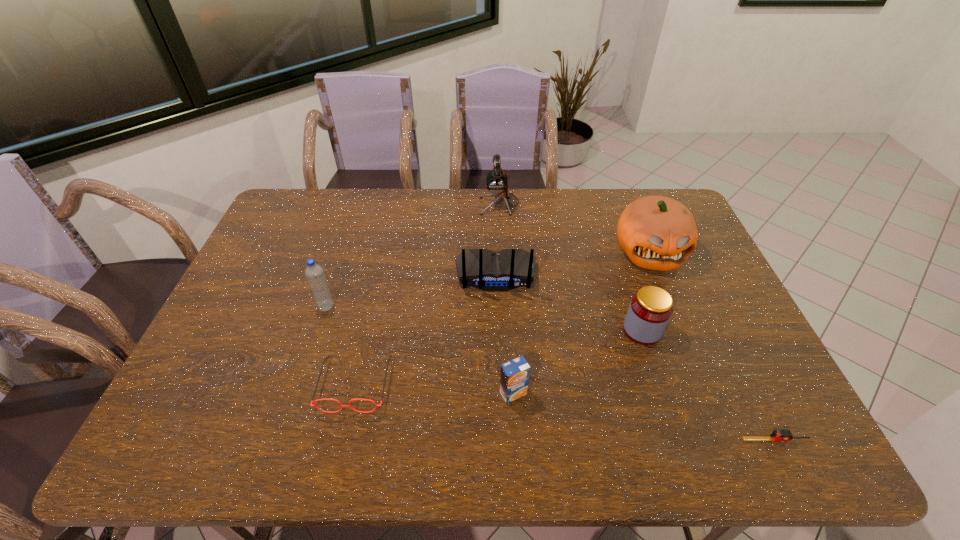
What are the coordinates of `object situated at the near edge` in the screenshot? It's located at (779, 435).

Locate an element on the screen. The image size is (960, 540). pumpkin positioned at the right edge is located at coordinates (657, 233).

The image size is (960, 540). In order to click on tape measure at the right edge in this screenshot , I will do tap(779, 435).

This screenshot has width=960, height=540. What are the coordinates of `object that is at the far right corner` in the screenshot? It's located at (657, 233).

The image size is (960, 540). What are the coordinates of `object situated at the near right corner` in the screenshot? It's located at (779, 435).

Identify the location of free space at the far edge of the desktop. (x=492, y=206).

In the image, there is a desktop. Identify the location of vacant space at the near edge. This screenshot has height=540, width=960. (585, 423).

The image size is (960, 540). Find the location of `vacant region at the left edge of the desktop`. vacant region at the left edge of the desktop is located at coordinates (272, 286).

At what (x,y) coordinates should I click in order to perform the action: click on vacant space at the right edge of the desktop. Please return your answer as a coordinate pair (x, y). This screenshot has height=540, width=960. Looking at the image, I should click on (744, 394).

Find the location of `vacant space at the near left corner of the desktop`. vacant space at the near left corner of the desktop is located at coordinates (189, 456).